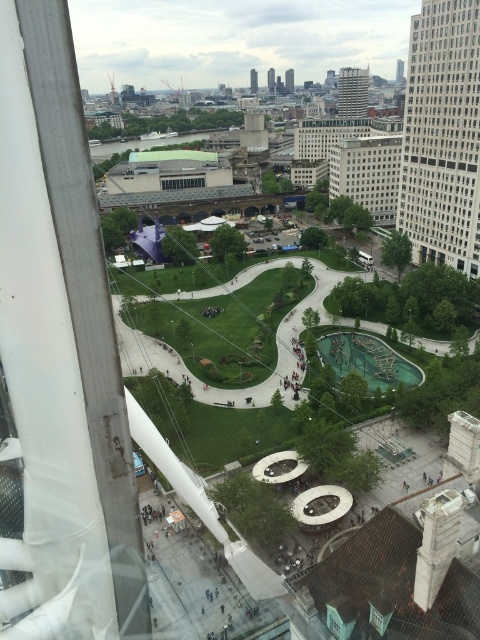
Question: Estimate the real-world distances between objects in this image. Which object is farther from the white glass building at right?

Choices:
 (A) clear glass window at center
 (B) white glass building at center
 (C) green wooden water park at center

Answer: (A)

Question: Which of these objects is positioned closest to the white glass building at right?

Choices:
 (A) clear glass window at center
 (B) white glass building at center
 (C) green wooden water park at center

Answer: (B)

Question: Does white glass building at right appear under green wooden water park at center?

Choices:
 (A) no
 (B) yes

Answer: (A)

Question: Is green wooden water park at center to the right of clear glass window at center from the viewer's perspective?

Choices:
 (A) yes
 (B) no

Answer: (A)

Question: Does white glass building at right have a larger size compared to clear glass window at center?

Choices:
 (A) no
 (B) yes

Answer: (B)

Question: Which point is closer to the camera taking this photo?

Choices:
 (A) (180, 188)
 (B) (460, 131)
 (C) (384, 374)

Answer: (C)